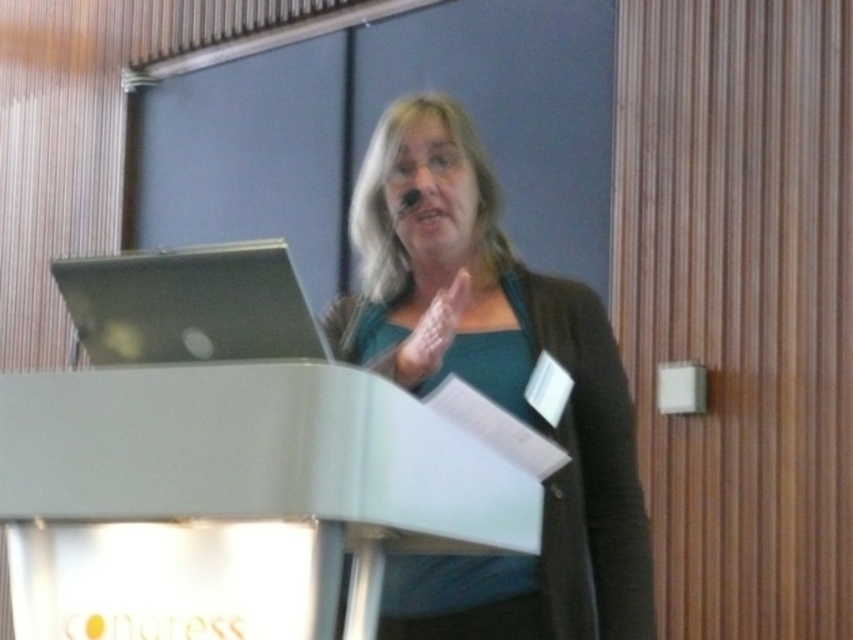
You are a GUI agent. You are given a task and a screenshot of the screen. Output one action in this format:
    pyautogui.click(x=<x>, y=<y>)
    Task: Click on the teal fabric shirt at center
    This screenshot has width=853, height=640.
    Given the screenshot: What is the action you would take?
    pyautogui.click(x=492, y=387)

Is point (364, 156) positioned behind point (207, 300)?

Yes, it is.

This screenshot has width=853, height=640. Identify the location of teal fabric shirt at center. (492, 387).

Is the position of white plastic podium at center more distant than that of silver metallic laptop at left?

No.

Which is more to the right, white plastic podium at center or silver metallic laptop at left?

white plastic podium at center is more to the right.

Describe the element at coordinates (256, 454) in the screenshot. The width and height of the screenshot is (853, 640). I see `white plastic podium at center` at that location.

Where is `white plastic podium at center`? The height and width of the screenshot is (640, 853). white plastic podium at center is located at coordinates (256, 454).

Does teal fabric shirt at center have a larger size compared to white plastic podium at center?

Correct, teal fabric shirt at center is larger in size than white plastic podium at center.

Between teal fabric shirt at center and white plastic podium at center, which one has less height?

white plastic podium at center

The image size is (853, 640). In order to click on teal fabric shirt at center in this screenshot , I will do `click(492, 387)`.